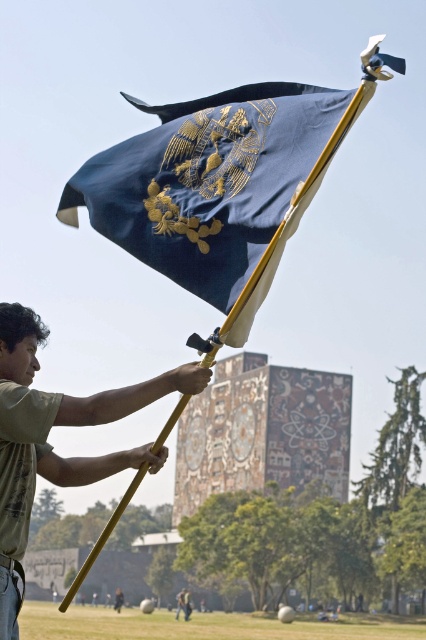
Question: Does blue silk flag at center have a larger size compared to green cotton shirt at center?

Choices:
 (A) no
 (B) yes

Answer: (A)

Question: Does blue silk flag at center appear on the right side of green cotton shirt at center?

Choices:
 (A) yes
 (B) no

Answer: (A)

Question: Which object is farther from the camera taking this photo?

Choices:
 (A) blue silk flag at center
 (B) green cotton shirt at center

Answer: (B)

Question: Which of the following is the closest to the observer?

Choices:
 (A) (6, 589)
 (B) (196, 205)

Answer: (B)

Question: In this image, where is blue silk flag at center located relative to green cotton shirt at center?

Choices:
 (A) left
 (B) right

Answer: (B)

Question: Which object appears closest to the camera in this image?

Choices:
 (A) green cotton shirt at center
 (B) blue silk flag at center

Answer: (B)